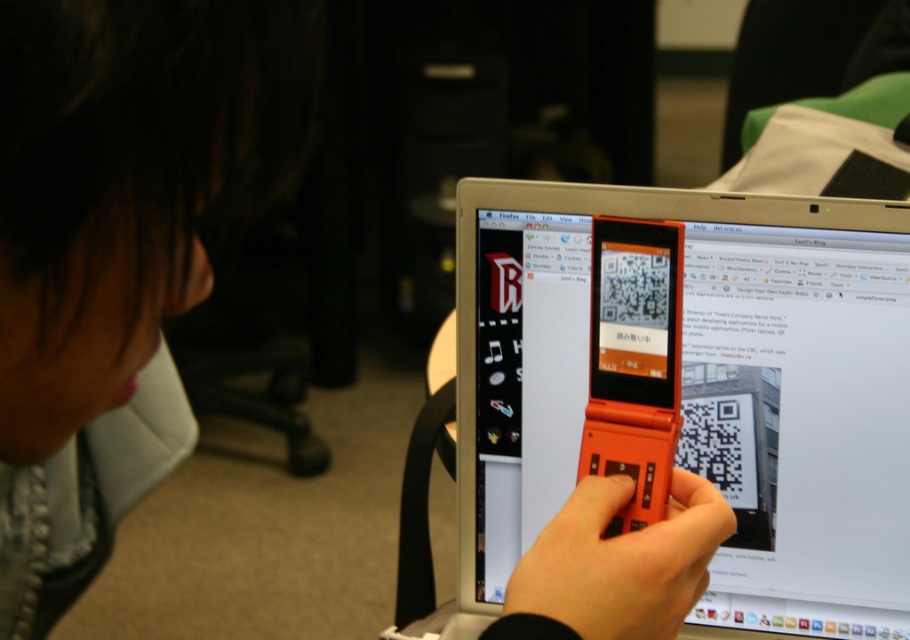
Who is shorter, orange matte phone at center or orange matte flip phone at center?

With less height is orange matte phone at center.

The width and height of the screenshot is (910, 640). What do you see at coordinates (615, 564) in the screenshot?
I see `orange matte phone at center` at bounding box center [615, 564].

Find the location of a particular element. orange matte phone at center is located at coordinates (615, 564).

Is matte plastic screen at center below orange matte phone at center?

Incorrect, matte plastic screen at center is not positioned below orange matte phone at center.

Who is more distant from viewer, (587, 369) or (598, 531)?

The point (587, 369) is more distant.

The width and height of the screenshot is (910, 640). In order to click on matte plastic screen at center in this screenshot , I will do `click(800, 422)`.

Is the position of matte plastic screen at center less distant than that of orange matte flip phone at center?

No, matte plastic screen at center is behind orange matte flip phone at center.

Identify the location of matte plastic screen at center. Image resolution: width=910 pixels, height=640 pixels. (800, 422).

Locate an element on the screen. matte plastic screen at center is located at coordinates (800, 422).